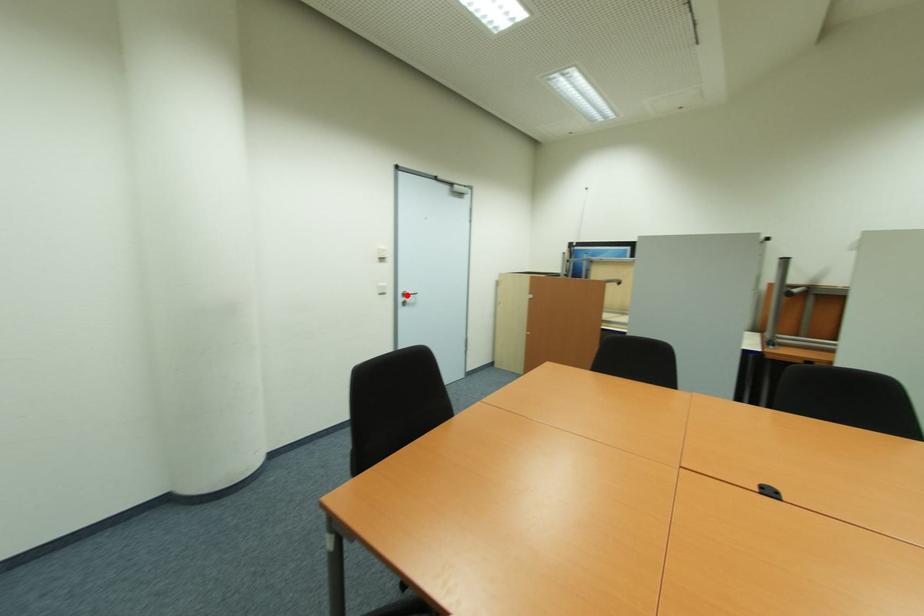
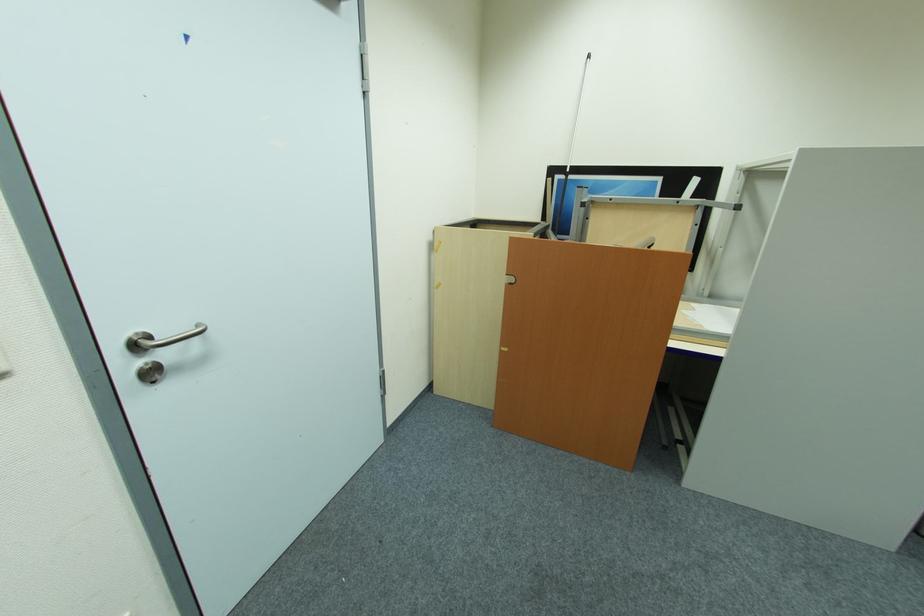
Locate, in the second image, the point that corresponds to the highlighted location in the first image.

(141, 347)